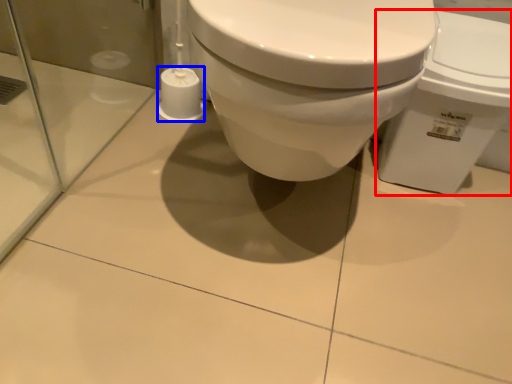
Question: Which object is closer to the camera taking this photo, toilet (highlighted by a red box) or toilet paper (highlighted by a blue box)?

Choices:
 (A) toilet
 (B) toilet paper

Answer: (A)